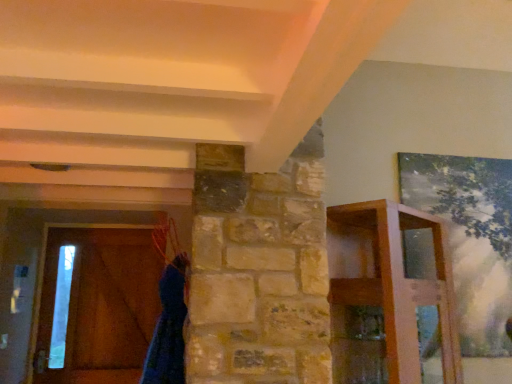
Question: Is brown wooden barn door at left smaller than blue fuzzy robe at lower left?

Choices:
 (A) no
 (B) yes

Answer: (B)

Question: Is brown wooden barn door at left aimed at blue fuzzy robe at lower left?

Choices:
 (A) no
 (B) yes

Answer: (B)

Question: Is there a large distance between brown wooden barn door at left and blue fuzzy robe at lower left?

Choices:
 (A) no
 (B) yes

Answer: (B)

Question: Considering the relative sizes of brown wooden barn door at left and blue fuzzy robe at lower left in the image provided, is brown wooden barn door at left wider than blue fuzzy robe at lower left?

Choices:
 (A) yes
 (B) no

Answer: (B)

Question: Is brown wooden barn door at left positioned before blue fuzzy robe at lower left?

Choices:
 (A) no
 (B) yes

Answer: (A)

Question: Does point (450, 299) appear closer or farther from the camera than point (156, 327)?

Choices:
 (A) closer
 (B) farther

Answer: (B)

Question: Is wooden shelf at right in front of or behind blue fuzzy robe at lower left in the image?

Choices:
 (A) behind
 (B) front

Answer: (B)

Question: From the image's perspective, is wooden shelf at right above or below blue fuzzy robe at lower left?

Choices:
 (A) below
 (B) above

Answer: (B)

Question: Is wooden shelf at right inside the boundaries of blue fuzzy robe at lower left, or outside?

Choices:
 (A) outside
 (B) inside

Answer: (A)

Question: Is blue fuzzy robe at lower left wider or thinner than brown wooden barn door at left?

Choices:
 (A) wide
 (B) thin

Answer: (A)

Question: In terms of size, does blue fuzzy robe at lower left appear bigger or smaller than brown wooden barn door at left?

Choices:
 (A) small
 (B) big

Answer: (B)

Question: From a real-world perspective, relative to brown wooden barn door at left, is blue fuzzy robe at lower left vertically above or below?

Choices:
 (A) above
 (B) below

Answer: (B)

Question: Is blue fuzzy robe at lower left to the left or to the right of brown wooden barn door at left in the image?

Choices:
 (A) left
 (B) right

Answer: (B)

Question: From a real-world perspective, is brown wooden barn door at left positioned above or below blue fuzzy robe at lower left?

Choices:
 (A) below
 (B) above

Answer: (B)

Question: Is point (131, 253) closer or farther from the camera than point (159, 299)?

Choices:
 (A) closer
 (B) farther

Answer: (B)